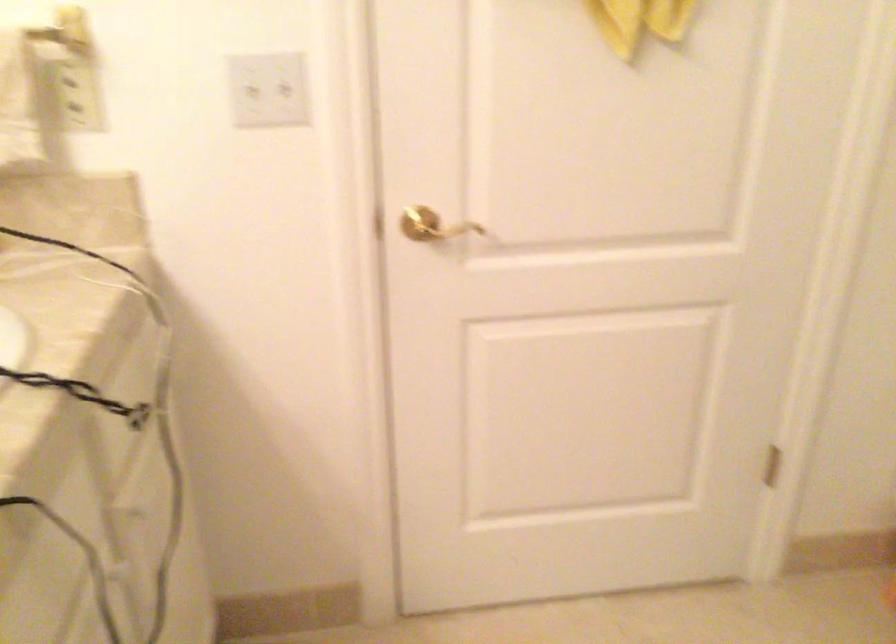
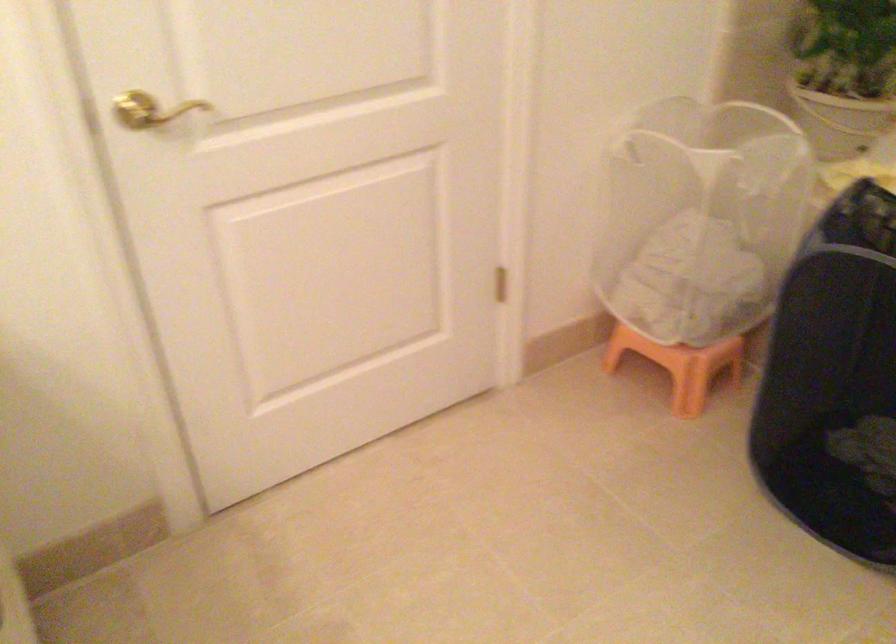
Question: The first image is from the beginning of the video and the second image is from the end. How did the camera likely rotate when shooting the video?

Choices:
 (A) Left
 (B) Right
 (C) Up
 (D) Down

Answer: (B)